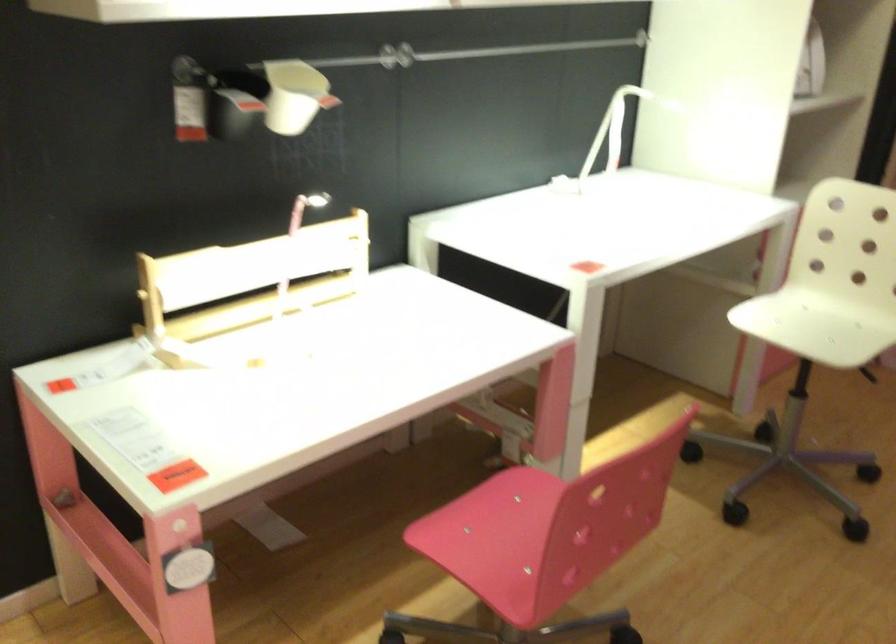
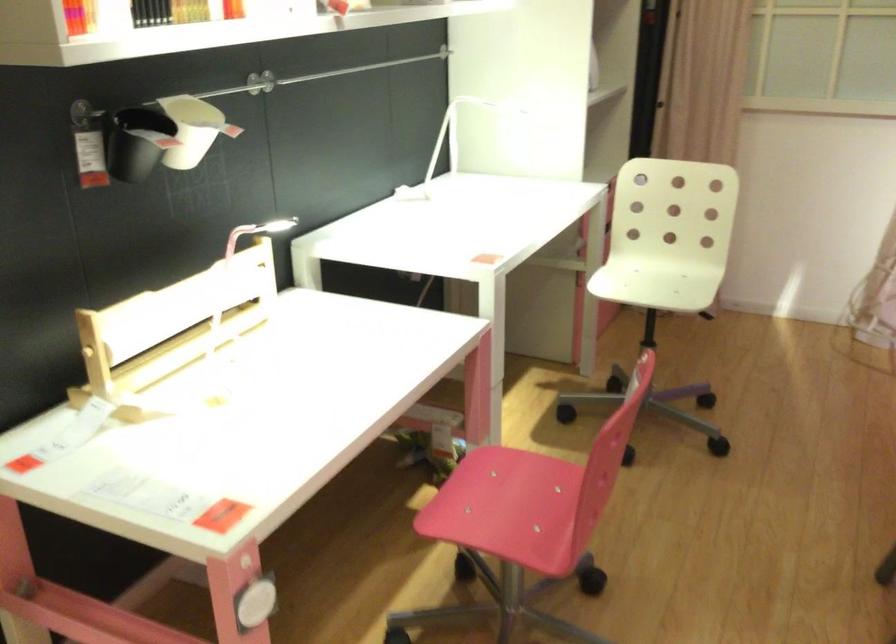
Question: The images are taken continuously from a first-person perspective. In which direction is your viewpoint rotating?

Choices:
 (A) Left
 (B) Right
 (C) Up
 (D) Down

Answer: (B)